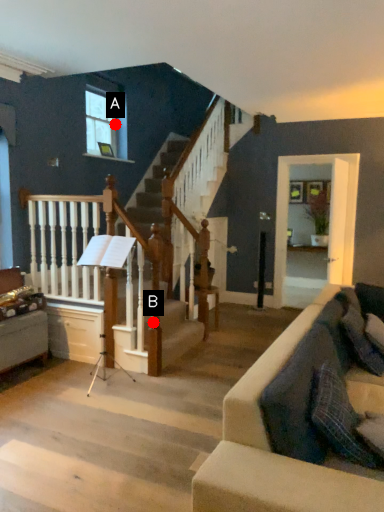
Question: Two points are circled on the image, labeled by A and B beside each circle. Which point is farther from the camera taking this photo?

Choices:
 (A) A is further
 (B) B is further

Answer: (A)